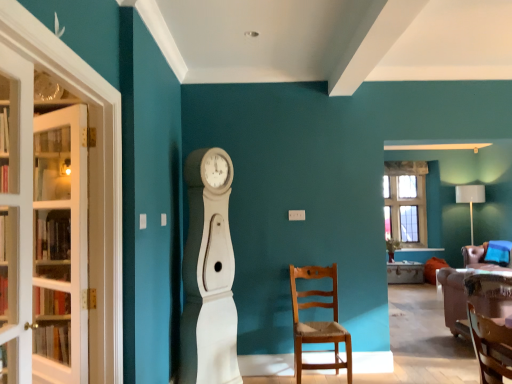
Question: Is white glass door at left, placed as the first door when sorted from back to front, behind white wood clock at center?

Choices:
 (A) yes
 (B) no

Answer: (B)

Question: Is white glass door at left, which is the first door from left to right, wider than white wood clock at center?

Choices:
 (A) yes
 (B) no

Answer: (B)

Question: Is white glass door at left, the second door positioned from the front, to the left of white wood clock at center from the viewer's perspective?

Choices:
 (A) yes
 (B) no

Answer: (A)

Question: From a real-world perspective, is white glass door at left, the second door positioned from the right, physically above white wood clock at center?

Choices:
 (A) yes
 (B) no

Answer: (A)

Question: From the image's perspective, would you say white glass door at left, placed as the first door when sorted from back to front, is shown under white wood clock at center?

Choices:
 (A) no
 (B) yes

Answer: (A)

Question: Considering the relative sizes of white glass door at left, the second door positioned from the front, and white wood clock at center in the image provided, is white glass door at left, the second door positioned from the front, thinner than white wood clock at center?

Choices:
 (A) yes
 (B) no

Answer: (A)

Question: From the image's perspective, is white glass door at left, placed as the first door when sorted from back to front, under clear glass cabinet at left?

Choices:
 (A) no
 (B) yes

Answer: (B)

Question: Is white glass door at left, the second door positioned from the right, positioned before clear glass cabinet at left?

Choices:
 (A) yes
 (B) no

Answer: (B)

Question: Does white glass door at left, which is the first door from left to right, have a greater height compared to clear glass cabinet at left?

Choices:
 (A) no
 (B) yes

Answer: (A)

Question: Does white glass door at left, placed as the first door when sorted from back to front, contain clear glass cabinet at left?

Choices:
 (A) no
 (B) yes

Answer: (A)

Question: Is white glass door at left, the second door positioned from the right, at the right side of clear glass cabinet at left?

Choices:
 (A) no
 (B) yes

Answer: (A)

Question: Is white glass door at left, the second door positioned from the front, located outside clear glass cabinet at left?

Choices:
 (A) no
 (B) yes

Answer: (B)

Question: Considering the relative sizes of clear glass window at upper right and wooden chair at center, the 2th chair positioned from the left, in the image provided, is clear glass window at upper right shorter than wooden chair at center, the 2th chair positioned from the left,?

Choices:
 (A) yes
 (B) no

Answer: (B)